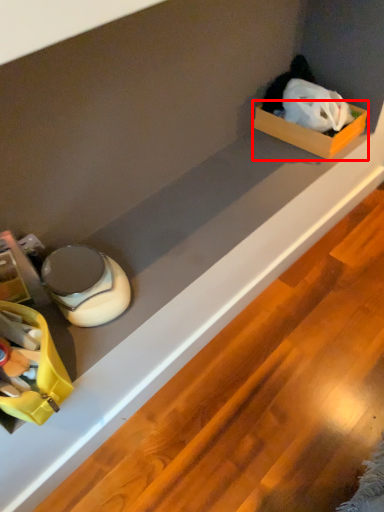
Question: From the image, what is the correct spatial relationship of box (annotated by the red box) in relation to storage box?

Choices:
 (A) right
 (B) left

Answer: (A)